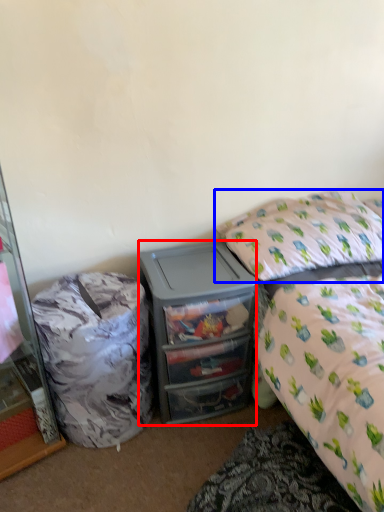
Question: Which object is closer to the camera taking this photo, desk (highlighted by a red box) or pillow (highlighted by a blue box)?

Choices:
 (A) desk
 (B) pillow

Answer: (B)